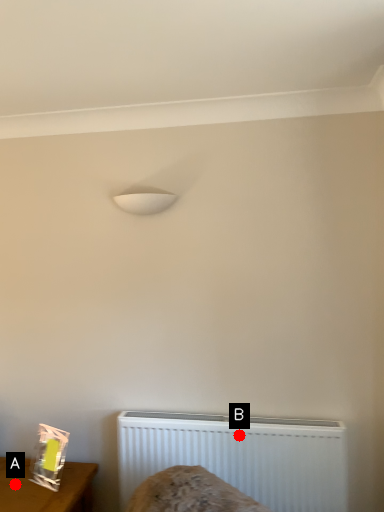
Question: Two points are circled on the image, labeled by A and B beside each circle. Which point is farther from the camera taking this photo?

Choices:
 (A) A is further
 (B) B is further

Answer: (A)